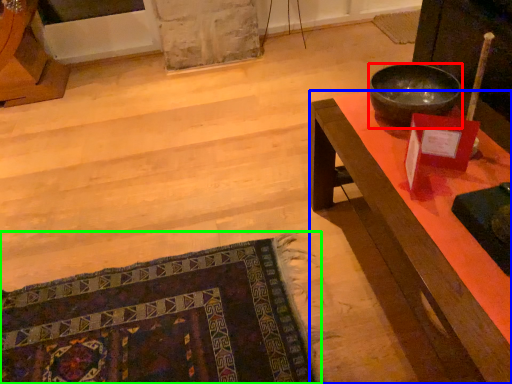
Question: Which object is the farthest from bowl (highlighted by a red box)? Choose among these: desk (highlighted by a blue box) or mat (highlighted by a green box).

Choices:
 (A) desk
 (B) mat

Answer: (B)